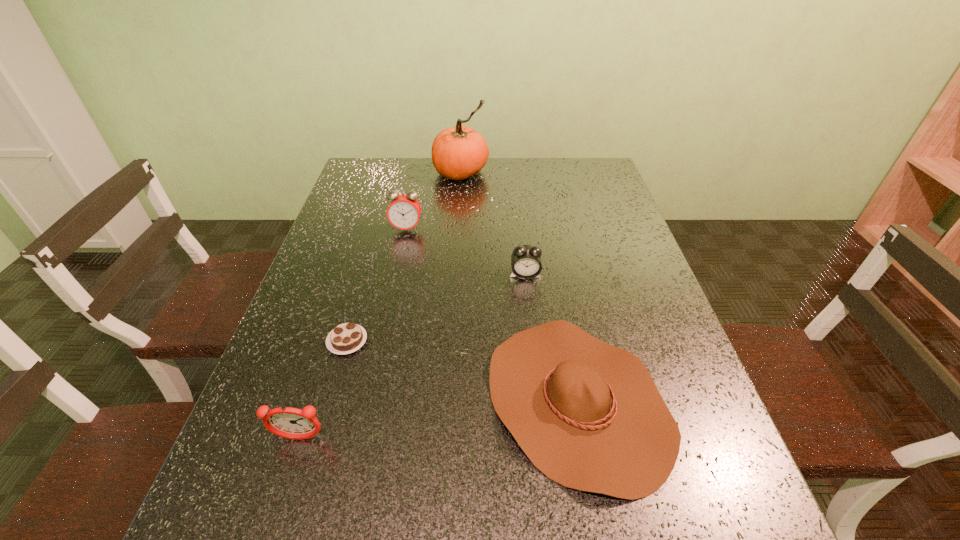
The width and height of the screenshot is (960, 540). In order to click on free spot at the left edge of the desktop in this screenshot , I will do `click(383, 225)`.

At what (x,y) coordinates should I click in order to perform the action: click on free space at the right edge. Please return your answer as a coordinate pair (x, y). Looking at the image, I should click on (662, 378).

The height and width of the screenshot is (540, 960). In order to click on vacant space at the far left corner of the desktop in this screenshot , I will do `click(396, 175)`.

Where is `vacant space in between the leftmost alarm clock and the chocolate cake`? This screenshot has height=540, width=960. vacant space in between the leftmost alarm clock and the chocolate cake is located at coordinates (324, 390).

Identify the location of free space between the shortest object and the second farthest alarm clock. This screenshot has width=960, height=540. point(436,308).

Image resolution: width=960 pixels, height=540 pixels. I want to click on empty space that is in between the fifth tallest object and the farthest alarm clock, so click(492, 315).

The image size is (960, 540). I want to click on free spot between the tallest alarm clock and the pumpkin, so click(x=434, y=201).

Find the location of a particular element. The width and height of the screenshot is (960, 540). empty space between the shortest object and the leftmost alarm clock is located at coordinates (324, 390).

The width and height of the screenshot is (960, 540). Identify the location of free area in between the fifth shortest object and the tallest object. (434, 201).

At what (x,y) coordinates should I click in order to perform the action: click on free point between the tallest object and the chocolate cake. Please return your answer as a coordinate pair (x, y). Looking at the image, I should click on (404, 256).